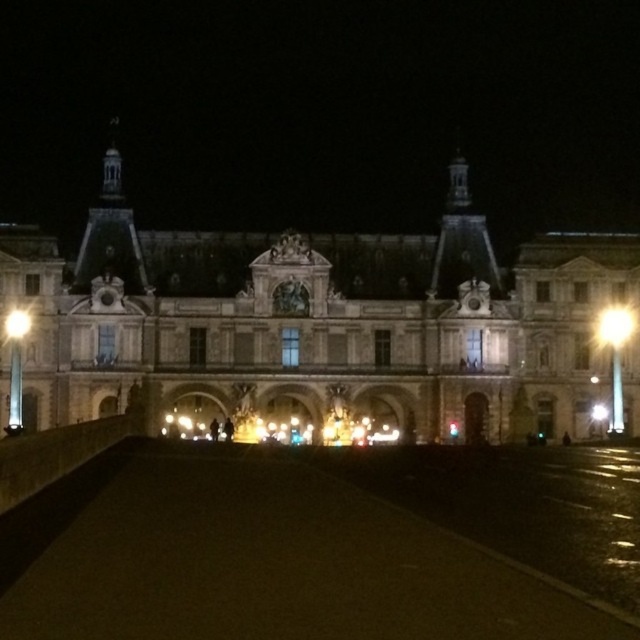
You are standing on the pathway leading to the building and notice two lights. Which light, the bright yellow light at upper right or the matte white light at left, is bigger in size?

The bright yellow light at upper right is larger in size than the matte white light at left.

You are standing at the entrance of the building and notice two lights. One is the bright yellow light at upper right and the other is the matte white light at left. Which light is taller?

The bright yellow light at upper right is taller than the matte white light at left.